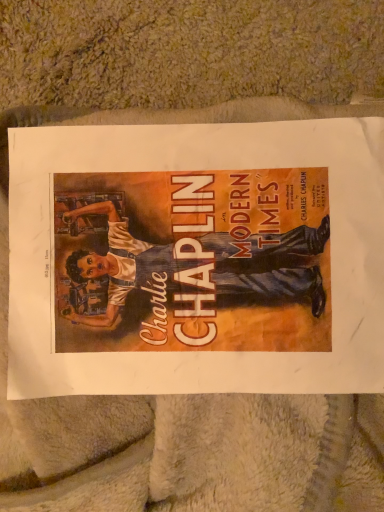
Question: Should I look upward or downward to see matte paper poster at center?

Choices:
 (A) down
 (B) up

Answer: (A)